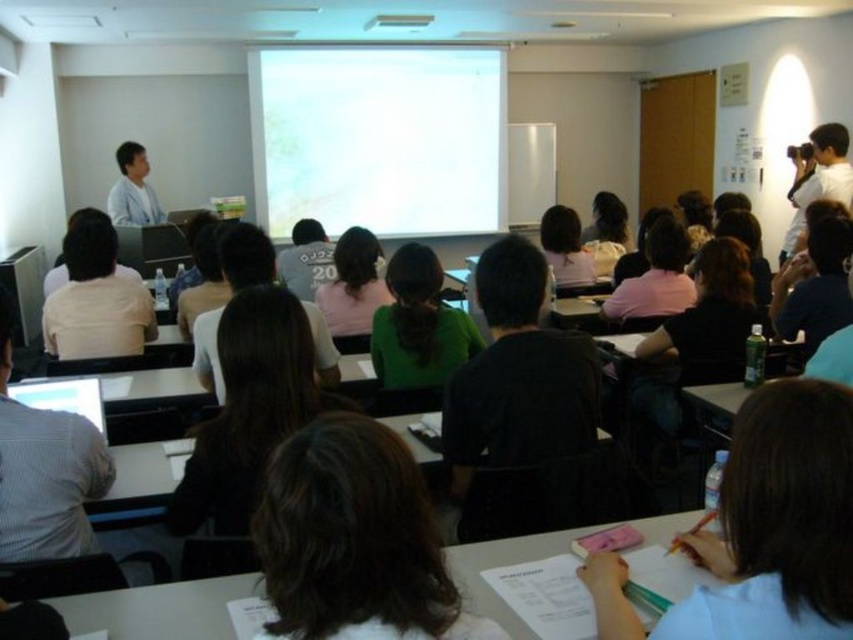
You are a student sitting in the classroom and want to place your notebook on the desk. Where should you put it so that it is directly in front of you? The desk has a coordinate system where the bottom left corner is at point 0,0 and the top right corner is at point 1,1. The white paper at center is already placed at point 0.817, 0.913. Use this as a reference to determine the correct coordinates for placing your notebook.

The white paper at center is located at coordinates (778, 522). To place your notebook directly in front of you, align it with the center point of the desk. Since the white paper is already near the upper right corner, you should place your notebook closer to the center coordinates around (426, 320) to ensure it is directly in front of you.

You are a student in the classroom and need to borrow a pen from someone. You see the green matte shirt at center and the light blue shirt at upper left. Which student is closer to you?

The light blue shirt at upper left is closer to you because it is positioned at upper left, which is typically nearer in such classroom setups.